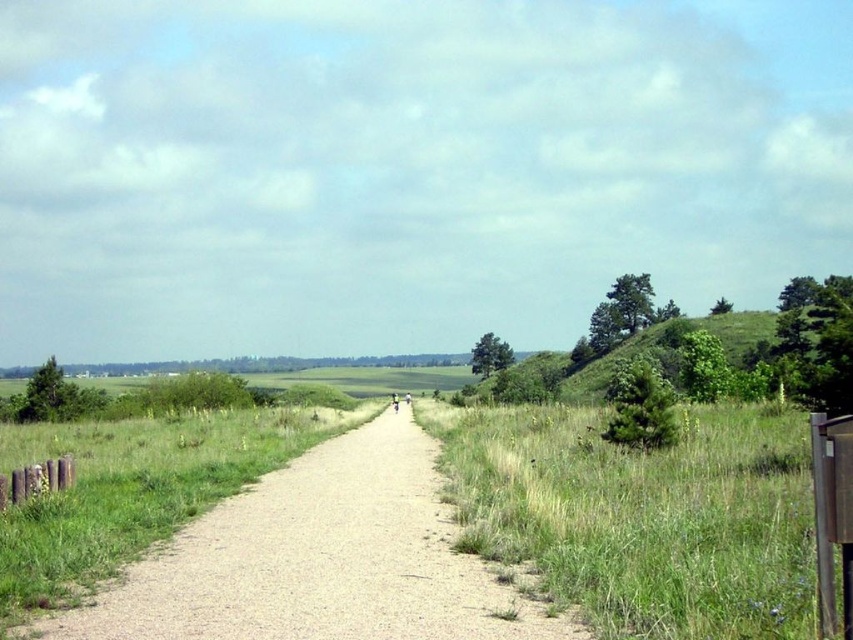
You are a hiker trying to decide between walking on the gravel path at center or the green grassy at right. Which path has a wider area?

The green grassy at right is wider than the gravel path at center according to the description.

You are standing at the starting point of the dirt path in the image. There is a point marked at coordinates (643,515) which is in the green grassy area at the right side of the path. If you walk straight along the path towards the distant horizon, will you pass by this point on your right side or left side?

The point marked at coordinates (643,515) is located in the green grassy area at the right side of the path. Since you are walking straight along the path towards the horizon, the right side of the path corresponds to your right side. Therefore, you will pass by this point on your right side.